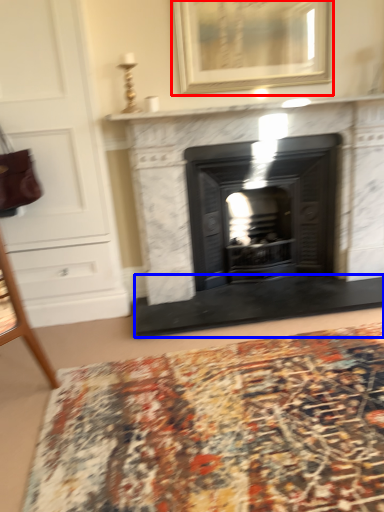
Question: Which point is further to the camera, picture frame (highlighted by a red box) or doormat (highlighted by a blue box)?

Choices:
 (A) picture frame
 (B) doormat

Answer: (B)